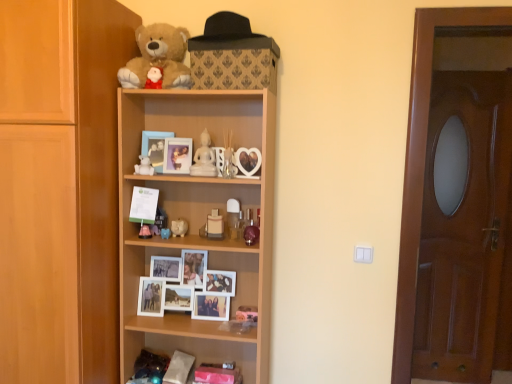
Describe the element at coordinates (424, 161) in the screenshot. The image size is (512, 384). I see `brown wooden door at right` at that location.

The height and width of the screenshot is (384, 512). What do you see at coordinates (228, 157) in the screenshot?
I see `translucent glass vase at center, arranged as the first toy when viewed from the right` at bounding box center [228, 157].

Identify the location of wooden shelf at center, which is the 2th shelf from bottom to top. (199, 221).

Where is `white glossy figurine at upper center`? The height and width of the screenshot is (384, 512). white glossy figurine at upper center is located at coordinates (204, 158).

The width and height of the screenshot is (512, 384). In order to click on matte wooden picture frame at center, which is counted as the 2th picture frame, starting from the right in this screenshot , I will do `click(155, 147)`.

At what (x,y) coordinates should I click in order to perform the action: click on white wooden photo frames at center, positioned as the 1th shelf in bottom-to-top order. Please return your answer as a coordinate pair (x, y). Looking at the image, I should click on (188, 328).

This screenshot has width=512, height=384. I want to click on brown wooden door at right, so click(424, 161).

Between wooden photo frame at center, placed as the second picture frame when sorted from left to right, and matte white piggy bank at center, arranged as the third toy when viewed from the right, which one has less height?

Standing shorter between the two is matte white piggy bank at center, arranged as the third toy when viewed from the right.

Looking at this image, what's the angular difference between wooden photo frame at center, placed as the second picture frame when sorted from left to right, and matte white piggy bank at center, which ranks as the 3th toy in left-to-right order,'s facing directions?

The facing directions of wooden photo frame at center, placed as the second picture frame when sorted from left to right, and matte white piggy bank at center, which ranks as the 3th toy in left-to-right order, are 16.5 degrees apart.

Identify the location of the 1st toy to the left of the wooden photo frame at center, positioned as the first picture frame in right-to-left order, counting from the anchor's position. (165, 233).

Is wooden photo frame at center, positioned as the first picture frame in right-to-left order, turned away from matte white piggy bank at center, arranged as the third toy when viewed from the right?

No, wooden photo frame at center, positioned as the first picture frame in right-to-left order,'s orientation is not away from matte white piggy bank at center, arranged as the third toy when viewed from the right.

Based on the photo, from the image's perspective, which one is positioned higher, wooden cupboard at left or wooden photo frame at center, positioned as the first picture frame in right-to-left order?

From the image's view, wooden photo frame at center, positioned as the first picture frame in right-to-left order, is above.

Is wooden cupboard at left facing towards wooden photo frame at center, placed as the second picture frame when sorted from left to right?

No, wooden cupboard at left is not oriented towards wooden photo frame at center, placed as the second picture frame when sorted from left to right.

Is wooden cupboard at left bigger or smaller than wooden photo frame at center, placed as the second picture frame when sorted from left to right?

Clearly, wooden cupboard at left is larger in size than wooden photo frame at center, placed as the second picture frame when sorted from left to right.

Considering the relative positions of wooden cupboard at left and wooden photo frame at center, positioned as the first picture frame in right-to-left order, in the image provided, is wooden cupboard at left to the left of wooden photo frame at center, positioned as the first picture frame in right-to-left order, from the viewer's perspective?

Correct, you'll find wooden cupboard at left to the left of wooden photo frame at center, positioned as the first picture frame in right-to-left order.

Is white paper at middle facing towards white wooden photo frames at center, positioned as the 1th shelf in bottom-to-top order?

No, white paper at middle does not turn towards white wooden photo frames at center, positioned as the 1th shelf in bottom-to-top order.

Looking at this image, is white paper at middle beside white wooden photo frames at center, positioned as the 1th shelf in bottom-to-top order?

No, white paper at middle is not beside white wooden photo frames at center, positioned as the 1th shelf in bottom-to-top order.

Which is more distant, (141, 210) or (193, 322)?

Positioned behind is point (193, 322).

Is matte wooden picture frame at center, the 1th picture frame viewed from the left, shorter than wooden photo frame at center, placed as the second picture frame when sorted from left to right?

No, matte wooden picture frame at center, the 1th picture frame viewed from the left, is not shorter than wooden photo frame at center, placed as the second picture frame when sorted from left to right.

From the image's perspective, is matte wooden picture frame at center, the 1th picture frame viewed from the left, above wooden photo frame at center, placed as the second picture frame when sorted from left to right?

Yes, from the image's perspective, matte wooden picture frame at center, the 1th picture frame viewed from the left, is above wooden photo frame at center, placed as the second picture frame when sorted from left to right.

Is wooden photo frame at center, placed as the second picture frame when sorted from left to right, surrounded by matte wooden picture frame at center, the 1th picture frame viewed from the left?

No, wooden photo frame at center, placed as the second picture frame when sorted from left to right, is not a part of matte wooden picture frame at center, the 1th picture frame viewed from the left.

Can you tell me how much matte wooden picture frame at center, the 1th picture frame viewed from the left, and wooden photo frame at center, placed as the second picture frame when sorted from left to right, differ in facing direction?

They differ by 1.83 degrees in their facing directions.

In the image, is white matte bear at upper center, acting as the first toy starting from the left, positioned in front of or behind wooden shelf at center, which is the 2th shelf from bottom to top?

In the image, white matte bear at upper center, acting as the first toy starting from the left, appears behind wooden shelf at center, which is the 2th shelf from bottom to top.

Is white matte bear at upper center, acting as the first toy starting from the left, aimed at wooden shelf at center, the 1th shelf in the top-to-bottom sequence?

Yes, white matte bear at upper center, acting as the first toy starting from the left, is oriented towards wooden shelf at center, the 1th shelf in the top-to-bottom sequence.

From a real-world perspective, is translucent glass vase at center, arranged as the first toy when viewed from the right, positioned over matte white piggy bank at center, which ranks as the 3th toy in left-to-right order, based on gravity?

Yes, from a real-world perspective, translucent glass vase at center, arranged as the first toy when viewed from the right, is over matte white piggy bank at center, which ranks as the 3th toy in left-to-right order

Is translucent glass vase at center, marked as the fifth toy in a left-to-right arrangement, taller or shorter than matte white piggy bank at center, arranged as the third toy when viewed from the right?

Considering their sizes, translucent glass vase at center, marked as the fifth toy in a left-to-right arrangement, has more height than matte white piggy bank at center, arranged as the third toy when viewed from the right.

Is translucent glass vase at center, marked as the fifth toy in a left-to-right arrangement, with matte white piggy bank at center, arranged as the third toy when viewed from the right?

No, translucent glass vase at center, marked as the fifth toy in a left-to-right arrangement, is not making contact with matte white piggy bank at center, arranged as the third toy when viewed from the right.

Could you tell me if translucent glass vase at center, arranged as the first toy when viewed from the right, is facing matte white piggy bank at center, which ranks as the 3th toy in left-to-right order?

No, translucent glass vase at center, arranged as the first toy when viewed from the right, is not turned towards matte white piggy bank at center, which ranks as the 3th toy in left-to-right order.

Considering the positions of point (145, 181) and point (244, 334), is point (145, 181) closer or farther from the camera than point (244, 334)?

Point (145, 181).

Can you confirm if wooden shelf at center, which is the 2th shelf from bottom to top, is smaller than white wooden photo frames at center, positioned as the 1th shelf in bottom-to-top order?

Incorrect, wooden shelf at center, which is the 2th shelf from bottom to top, is not smaller in size than white wooden photo frames at center, positioned as the 1th shelf in bottom-to-top order.

Is white wooden photo frames at center, arranged as the second shelf when viewed from the top, a part of wooden shelf at center, the 1th shelf in the top-to-bottom sequence?

Yes, white wooden photo frames at center, arranged as the second shelf when viewed from the top, can be found within wooden shelf at center, the 1th shelf in the top-to-bottom sequence.

Where is `the 4th toy positioned below the wooden photo frame at center, placed as the second picture frame when sorted from left to right (from the image's perspective)`? This screenshot has width=512, height=384. the 4th toy positioned below the wooden photo frame at center, placed as the second picture frame when sorted from left to right (from the image's perspective) is located at coordinates (165, 233).

From the wooden cupboard at left, count 1st picture frames backward and point to it. Please provide its 2D coordinates.

[(177, 155)]

Looking at the image, which one is located closer to white paper at middle, white glossy figurine at upper center or white ceramic cat at center, the 4th toy when ordered from left to right?

Based on the image, white ceramic cat at center, the 4th toy when ordered from left to right, appears to be nearer to white paper at middle.

Which object lies nearer to the anchor point wooden shelf at center, the 1th shelf in the top-to-bottom sequence, white ceramic cat at center, arranged as the 2th toy when viewed from the right, or white glossy figurine at upper center?

Based on the image, white glossy figurine at upper center appears to be nearer to wooden shelf at center, the 1th shelf in the top-to-bottom sequence.

From the image, which object appears to be nearer to brown wooden door at right, white ceramic cat at center, the 4th toy when ordered from left to right, or wooden cupboard at left?

Among the two, white ceramic cat at center, the 4th toy when ordered from left to right, is located nearer to brown wooden door at right.

Estimate the real-world distances between objects in this image. Which object is further from wooden cupboard at left, translucent glass vase at center, arranged as the first toy when viewed from the right, or wooden photo frame at center, positioned as the first picture frame in right-to-left order?

translucent glass vase at center, arranged as the first toy when viewed from the right, lies further to wooden cupboard at left than the other object.

Based on their spatial positions, is white glossy figurine at upper center or white ceramic cat at center, the 4th toy when ordered from left to right, closer to translucent glass vase at center, arranged as the first toy when viewed from the right?

white glossy figurine at upper center is positioned closer to the anchor translucent glass vase at center, arranged as the first toy when viewed from the right.

Estimate the real-world distances between objects in this image. Which object is closer to white glossy figurine at upper center, translucent glass vase at center, marked as the fifth toy in a left-to-right arrangement, or white wooden photo frames at center, positioned as the 1th shelf in bottom-to-top order?

translucent glass vase at center, marked as the fifth toy in a left-to-right arrangement, lies closer to white glossy figurine at upper center than the other object.

From the image, which object appears to be farther from wooden photo frame at center, positioned as the first picture frame in right-to-left order, wooden shelf at center, which is the 2th shelf from bottom to top, or white glossy figurine at upper center?

wooden shelf at center, which is the 2th shelf from bottom to top, lies further to wooden photo frame at center, positioned as the first picture frame in right-to-left order, than the other object.

Based on their spatial positions, is brown wooden door at right or translucent glass vase at center, marked as the fifth toy in a left-to-right arrangement, further from white glossy figurine at upper center?

brown wooden door at right lies further to white glossy figurine at upper center than the other object.

Identify the location of postcard between wooden shelf at center, the 1th shelf in the top-to-bottom sequence, and matte white piggy bank at center, placed as the fourth toy when sorted from right to left, from front to back. This screenshot has height=384, width=512. pos(144,205).

Identify the location of toy situated between white ceramic cat at center, arranged as the 2th toy when viewed from the right, and brown wooden door at right from left to right. (228, 157).

In order to click on shelf that lies between translucent glass vase at center, arranged as the first toy when viewed from the right, and white wooden photo frames at center, positioned as the 1th shelf in bottom-to-top order, from top to bottom in this screenshot , I will do `click(199, 221)`.

This screenshot has width=512, height=384. Identify the location of shelf between white glossy figurine at upper center and white wooden photo frames at center, positioned as the 1th shelf in bottom-to-top order, from top to bottom. (199, 221).